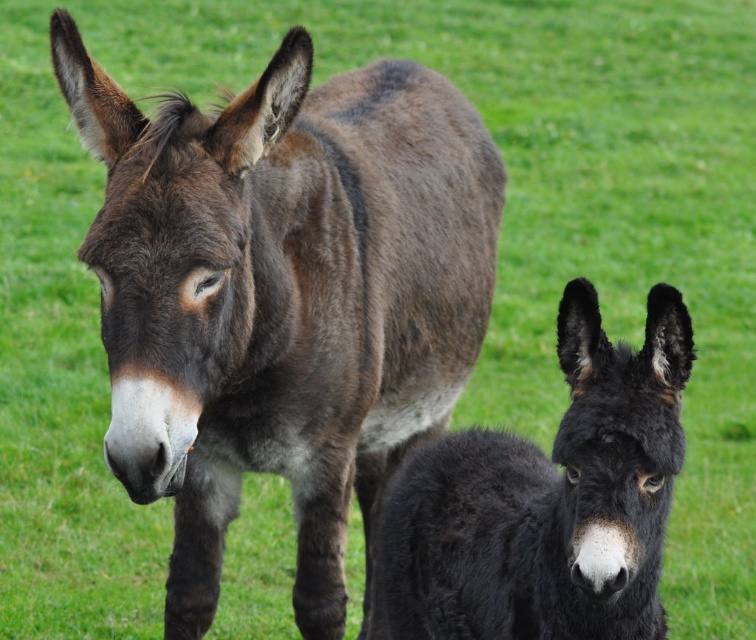
You are a photographer trying to capture both the dark brown fur mule at center and the black fuzzy donkey at lower right in the same frame. Based on their positions, which one would appear closer to the camera in the photo?

The dark brown fur mule at center appears closer to the camera because the black fuzzy donkey at lower right is positioned behind it.

You are a photographer standing in a field with a dark brown fur mule at center. You want to take a photo of it from a distance that ensures it fills the frame without being too close. Considering the mule is 8.58 feet away, would you need to move closer or farther away?

The dark brown fur mule at center is 8.58 feet from the camera. To ensure it fills the frame without being too close, you should move slightly farther away to maintain a balanced composition.

You are a farmer checking the field. You notice the dark brown fur mule at center and the black fuzzy donkey at lower right. Which animal is positioned higher in the image?

The dark brown fur mule at center is positioned higher in the image than the black fuzzy donkey at lower right.